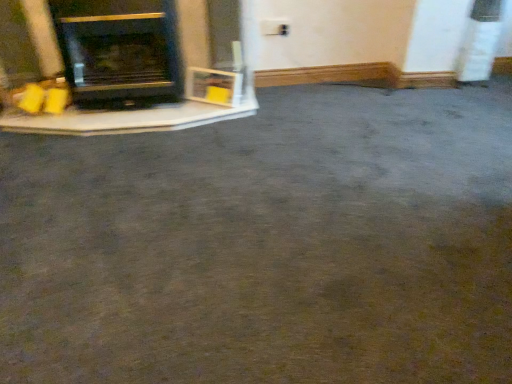
Question: Does matte black fireplace at left have a lesser height compared to black matte wood burning stove at left?

Choices:
 (A) yes
 (B) no

Answer: (A)

Question: Is matte black fireplace at left thinner than black matte wood burning stove at left?

Choices:
 (A) no
 (B) yes

Answer: (B)

Question: Considering the relative sizes of matte black fireplace at left and black matte wood burning stove at left in the image provided, is matte black fireplace at left smaller than black matte wood burning stove at left?

Choices:
 (A) yes
 (B) no

Answer: (B)

Question: Can you confirm if matte black fireplace at left is wider than black matte wood burning stove at left?

Choices:
 (A) no
 (B) yes

Answer: (A)

Question: Is matte black fireplace at left in contact with black matte wood burning stove at left?

Choices:
 (A) no
 (B) yes

Answer: (A)

Question: Does matte black fireplace at left have a larger size compared to black matte wood burning stove at left?

Choices:
 (A) yes
 (B) no

Answer: (A)

Question: Are black matte wood burning stove at left and matte black fireplace at left far apart?

Choices:
 (A) no
 (B) yes

Answer: (A)

Question: Can you confirm if black matte wood burning stove at left is wider than matte black fireplace at left?

Choices:
 (A) no
 (B) yes

Answer: (B)

Question: Considering the relative positions of black matte wood burning stove at left and matte black fireplace at left in the image provided, is black matte wood burning stove at left to the right of matte black fireplace at left from the viewer's perspective?

Choices:
 (A) yes
 (B) no

Answer: (A)

Question: From the image's perspective, is black matte wood burning stove at left on matte black fireplace at left?

Choices:
 (A) yes
 (B) no

Answer: (B)

Question: Is black matte wood burning stove at left bigger than matte black fireplace at left?

Choices:
 (A) yes
 (B) no

Answer: (B)

Question: Can you confirm if black matte wood burning stove at left is smaller than matte black fireplace at left?

Choices:
 (A) yes
 (B) no

Answer: (A)

Question: From a real-world perspective, relative to matte black fireplace at left, is black matte wood burning stove at left vertically above or below?

Choices:
 (A) below
 (B) above

Answer: (B)